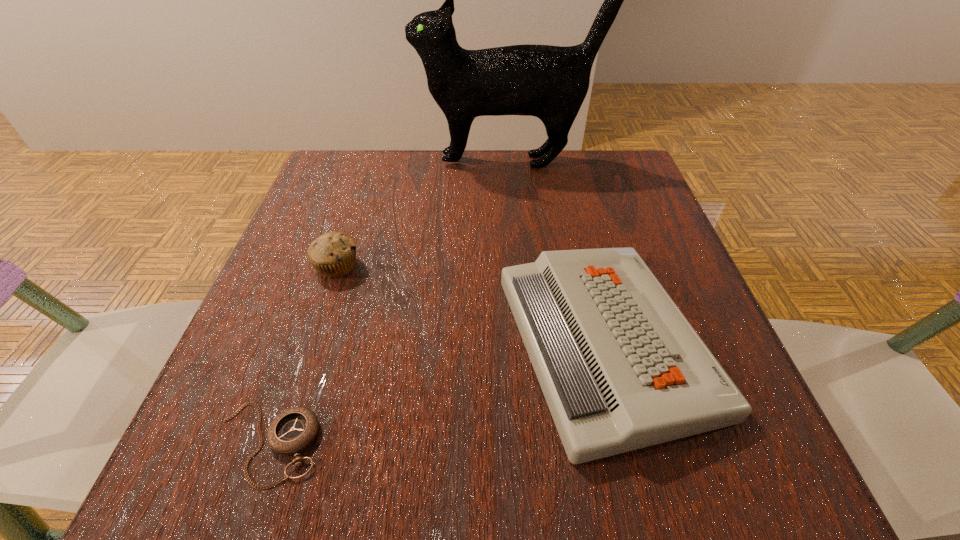
Identify the location of free space that satisfies the following two spatial constraints: 1. on the face of the farthest object; 2. on the front side of the shortest object. (538, 443).

Locate an element on the screen. The width and height of the screenshot is (960, 540). blank space that satisfies the following two spatial constraints: 1. on the face of the computer keyboard; 2. on the right side of the cat is located at coordinates (528, 343).